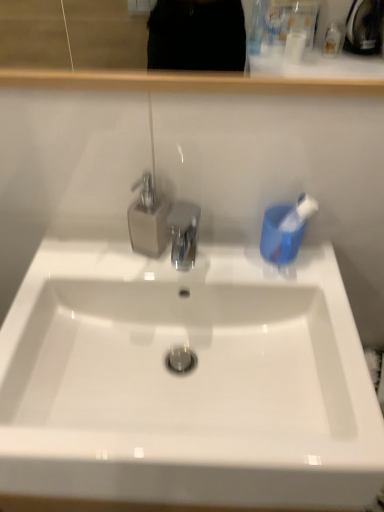
Identify the location of vacant space in front of blue plastic toothbrush at right. This screenshot has height=512, width=384. tap(321, 291).